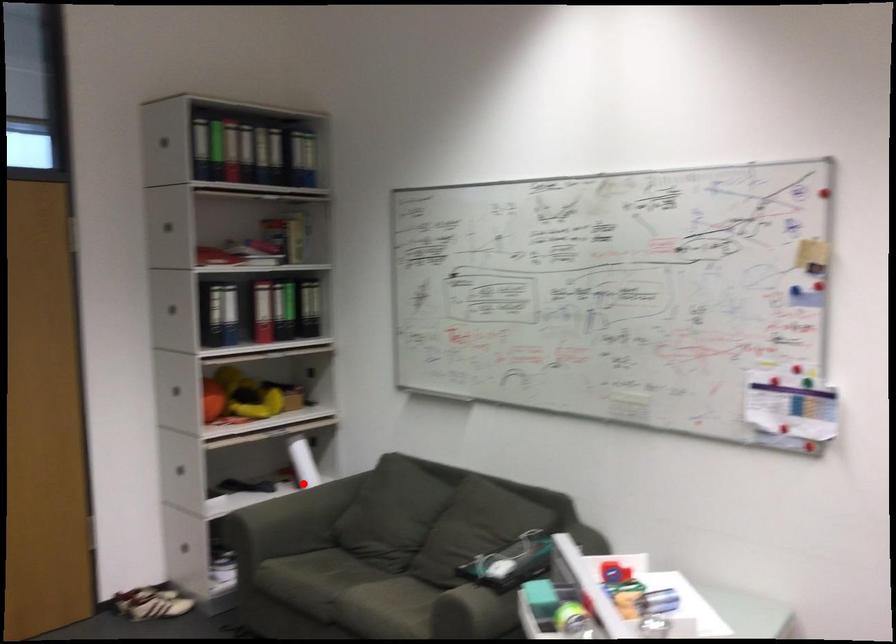
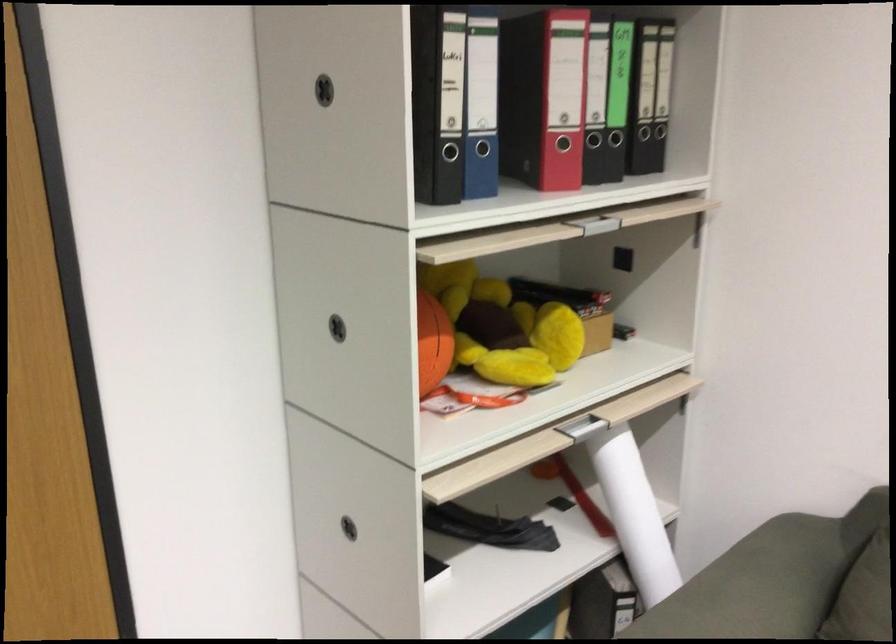
Where in the second image is the point corresponding to the highlighted location from the first image?

(633, 514)